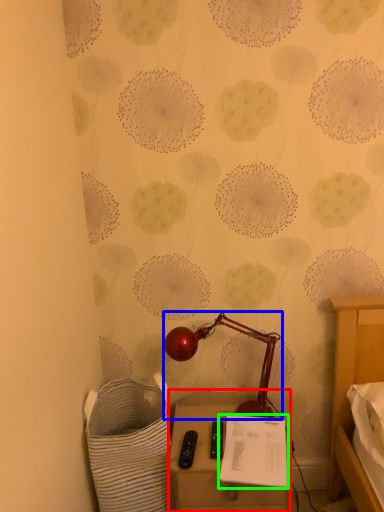
Question: Which is farther away from furniture (highlighted by a red box)? lamp (highlighted by a blue box) or notepad (highlighted by a green box)?

Choices:
 (A) lamp
 (B) notepad

Answer: (A)